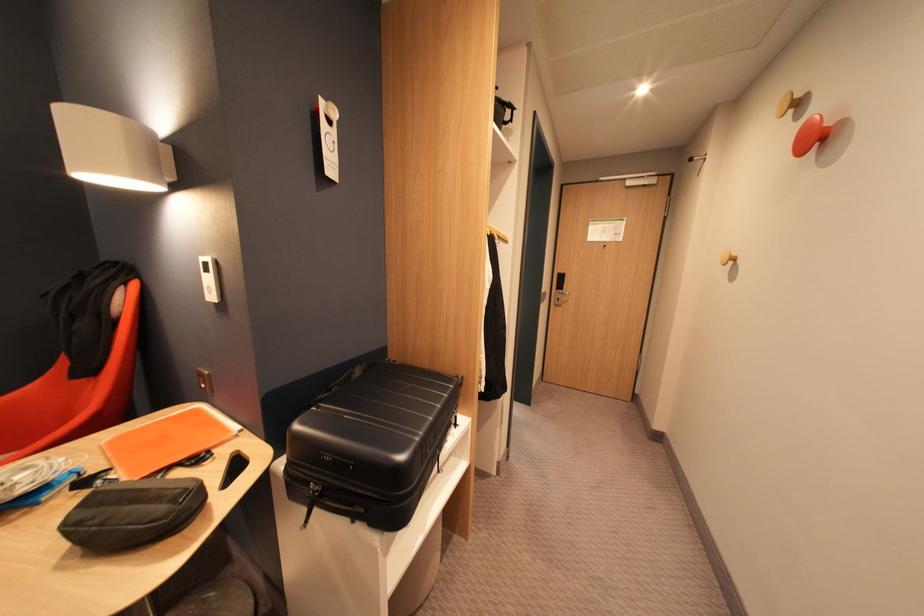
Find the location of a particular element. The height and width of the screenshot is (616, 924). black zippered pouch is located at coordinates (132, 514).